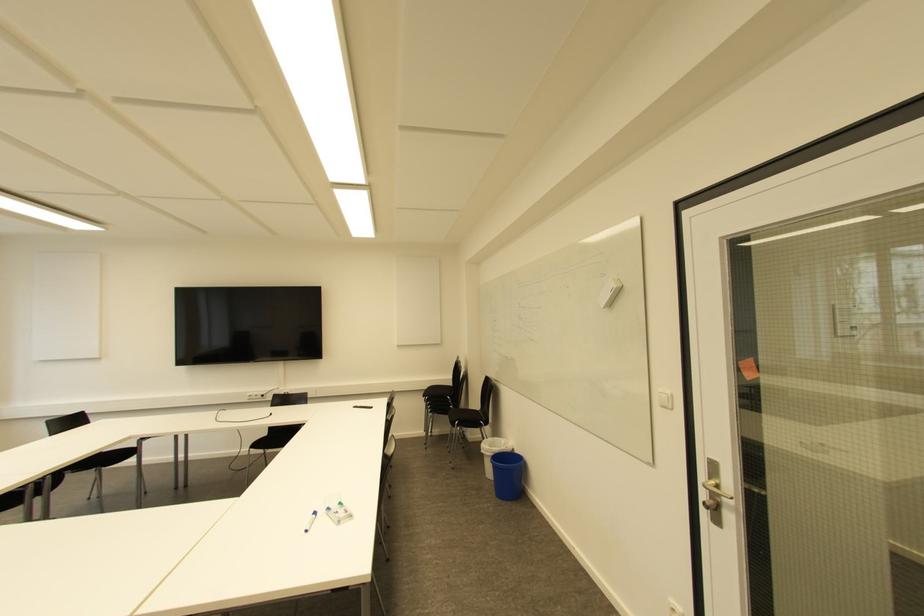
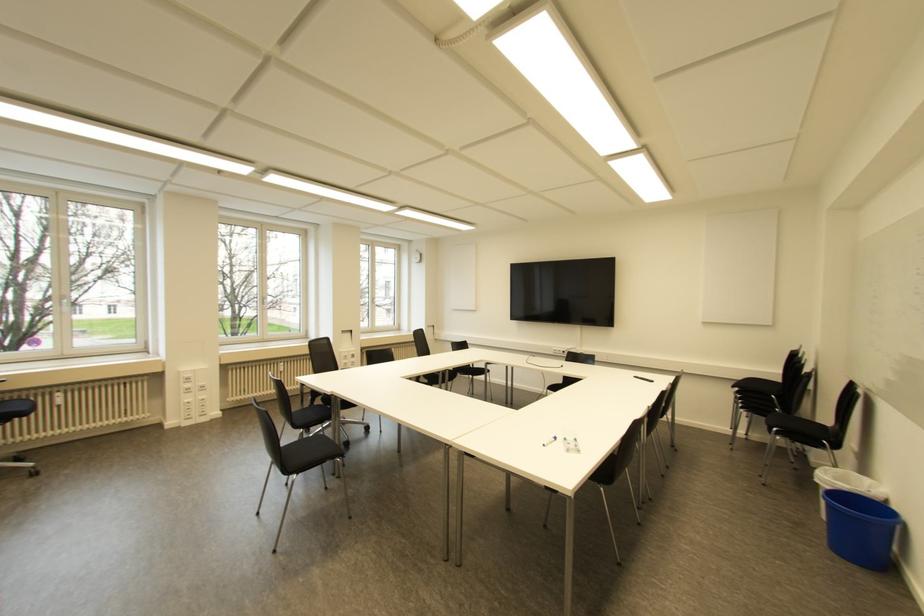
The point at (313, 514) is marked in the first image. Where is the corresponding point in the second image?

(554, 438)